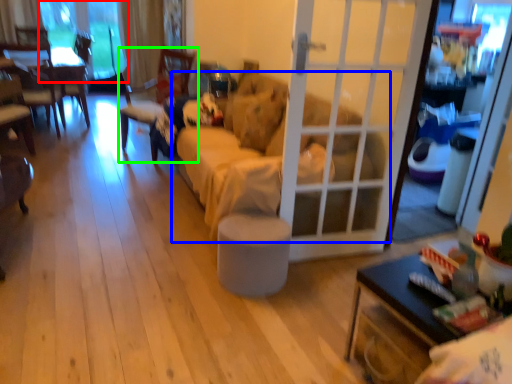
Question: Considering the real-world distances, which object is farthest from window screen (highlighted by a red box)? studio couch (highlighted by a blue box) or chair (highlighted by a green box)?

Choices:
 (A) studio couch
 (B) chair

Answer: (A)